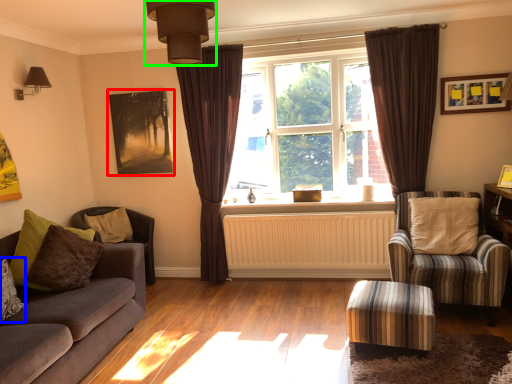
Question: Which is farther away from picture frame (highlighted by a red box)? pillow (highlighted by a blue box) or light fixture (highlighted by a green box)?

Choices:
 (A) pillow
 (B) light fixture

Answer: (B)